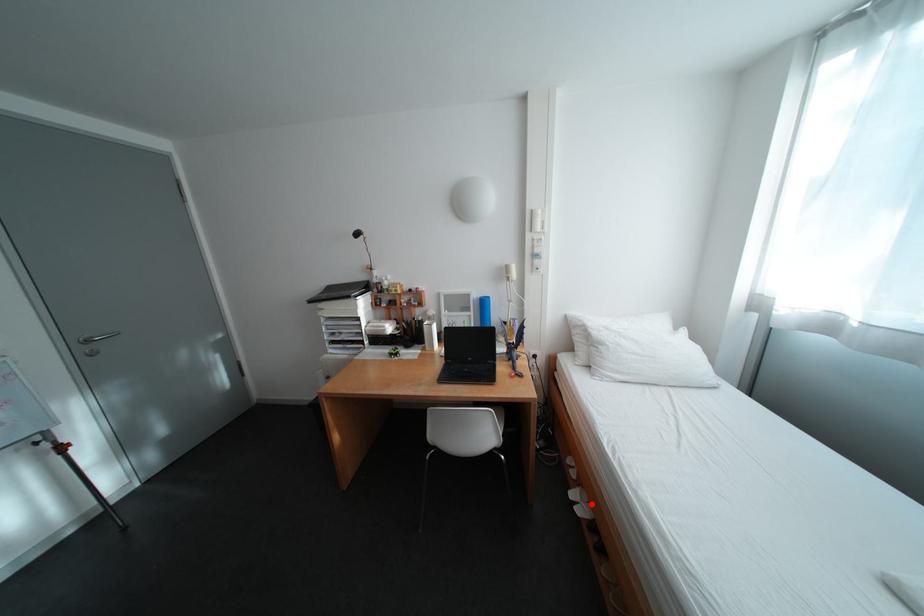
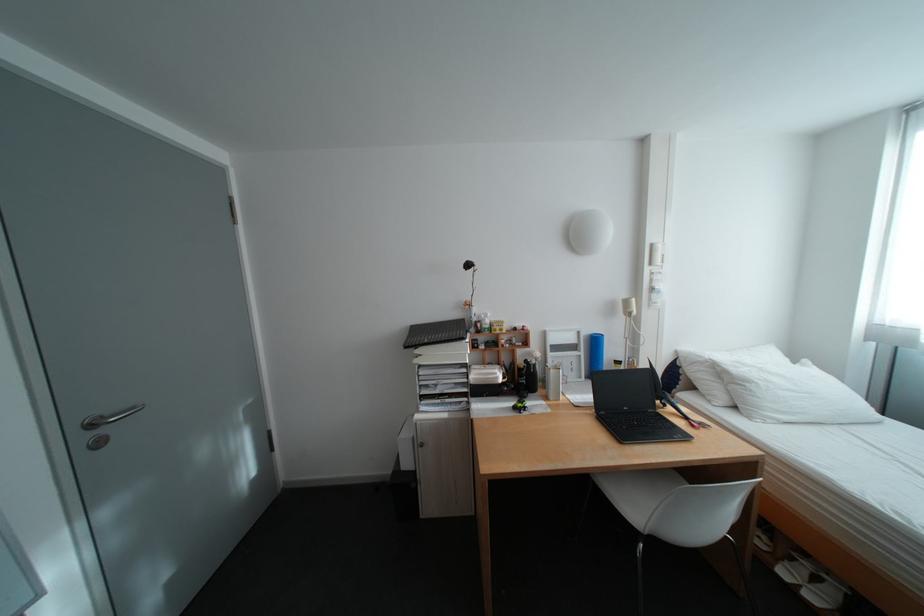
Question: I am providing you with two images of the same scene from different viewpoints. A red point is shown in image1. For the corresponding object point in image2, is it positioned nearer or farther from the camera?

Choices:
 (A) Nearer
 (B) Farther

Answer: (B)